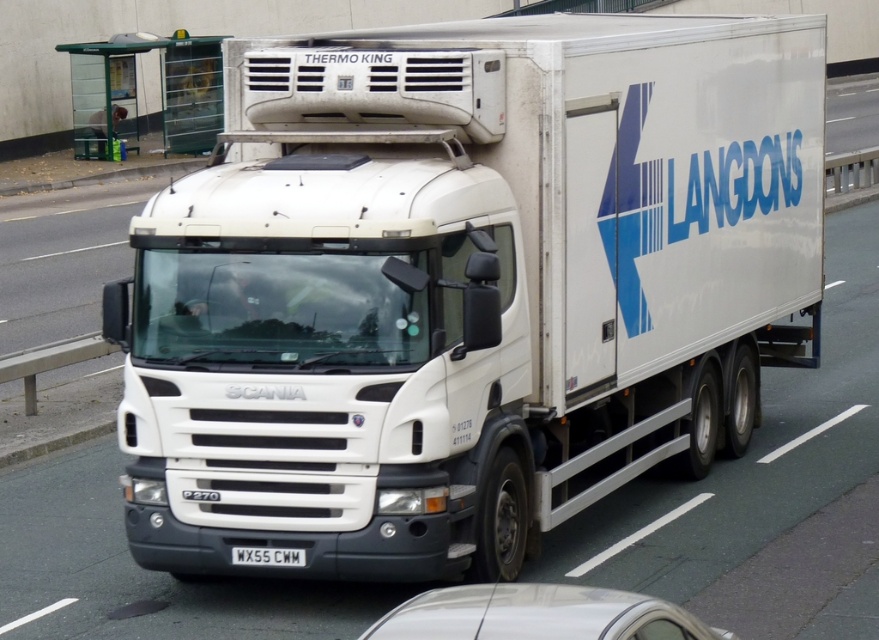
Which is in front, point (269, 86) or point (267, 547)?

Positioned in front is point (267, 547).

Who is more forward, (482, 141) or (289, 556)?

Point (289, 556) is in front.

Where is `white matte truck at center`? white matte truck at center is located at coordinates (465, 285).

Between white matte truck at center and white glossy car at lower center, which one has more height?

white matte truck at center

Does white matte truck at center come in front of white glossy car at lower center?

No, it is not.

Which is in front, point (325, 460) or point (442, 628)?

Point (442, 628) is in front.

This screenshot has width=879, height=640. I want to click on white matte truck at center, so click(x=465, y=285).

Between white glossy car at lower center and white plastic license plate at center, which one appears on the right side from the viewer's perspective?

Positioned to the right is white glossy car at lower center.

Is point (381, 634) closer to viewer compared to point (251, 560)?

Yes, it is.

Locate an element on the screen. The width and height of the screenshot is (879, 640). white glossy car at lower center is located at coordinates (538, 614).